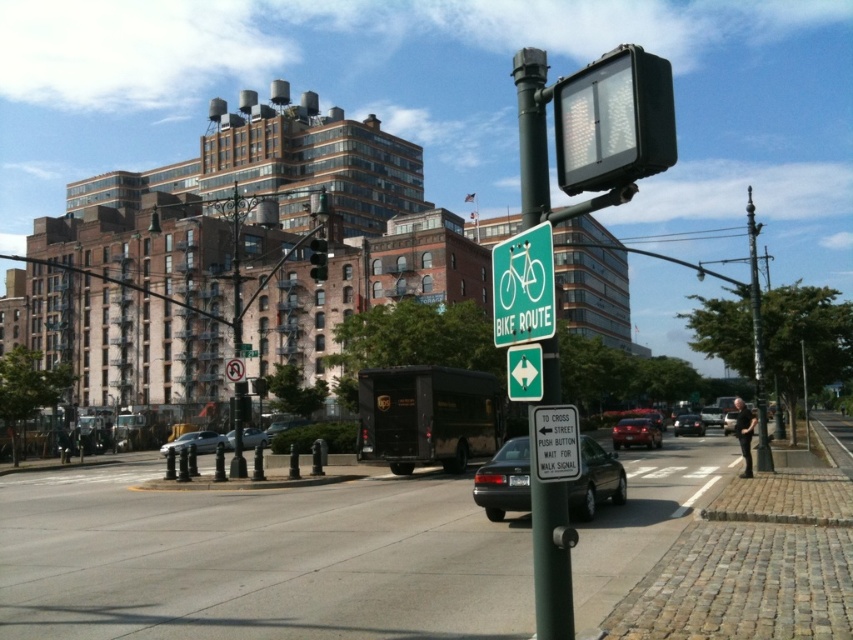
You are standing at the green Bike Route sign pole. You want to walk to the point marked at coordinates (196, 442). Is this point located on the silver metallic sedan at center left?

Yes, the point marked at coordinates (196, 442) is located on the silver metallic sedan at center left.

You are a city planner analyzing traffic flow. You need to determine if the black plastic traffic light at upper center can be replaced with a wider model without affecting the visibility of the shiny red sedan at center. Based on the current width comparison, what is your recommendation?

The black plastic traffic light at upper center has a lesser width compared to the shiny red sedan at center. Replacing it with a wider model might obstruct the view of the shiny red sedan at center, so it is not recommended.